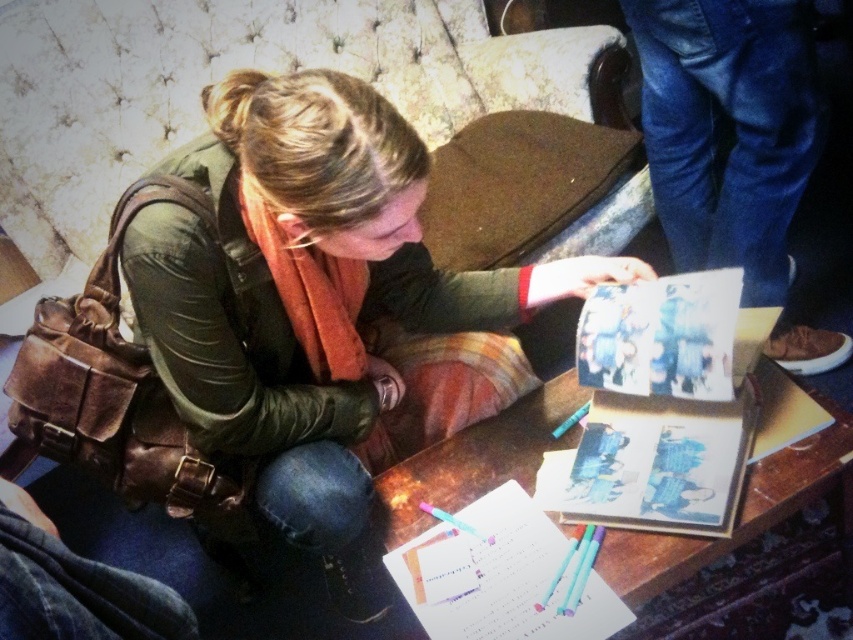
From the picture: You are a guest in this room and want to sit down at the wooden table at center. Is the matte green jacket at center currently blocking your access to the seat?

The matte green jacket at center is positioned over wooden table at center, so it is blocking access to the seat. Please move the jacket before sitting down.

You are a guest in this room and want to sit at the wooden table at center. However, there is a matte green jacket at center on the table. Can you sit there without moving the jacket?

The matte green jacket at center is in front of the wooden table at center, so it is likely placed on top of the table. Therefore, you would need to move the jacket to sit at the wooden table at center.

Where is the matte green jacket at center located in the image?

The matte green jacket at center is located at point coordinates of 0.472 on the x axis and 0.370 on the y axis.